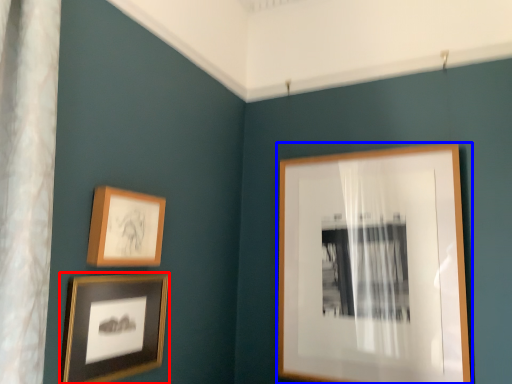
Question: Which of the following is the farthest to the observer, picture frame (highlighted by a red box) or picture frame (highlighted by a blue box)?

Choices:
 (A) picture frame
 (B) picture frame

Answer: (B)